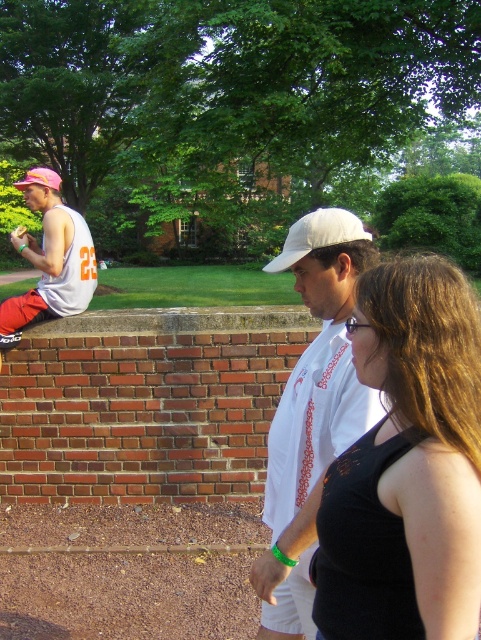
Is white cotton shirt at center to the left of matte white tank top at left from the viewer's perspective?

No, white cotton shirt at center is not to the left of matte white tank top at left.

Does white cotton shirt at center have a lesser width compared to matte white tank top at left?

Indeed, white cotton shirt at center has a lesser width compared to matte white tank top at left.

Who is more distant from viewer, [374,257] or [57,177]?

The point [57,177] is more distant.

In order to click on white cotton shirt at center in this screenshot , I will do `click(312, 413)`.

Between black fabric tank top at center and pink fabric baseball hat at left, which one is positioned higher?

pink fabric baseball hat at left is higher up.

Is point (468, 492) positioned before point (57, 188)?

Yes.

Locate an element on the screen. The width and height of the screenshot is (481, 640). black fabric tank top at center is located at coordinates (407, 465).

The width and height of the screenshot is (481, 640). Identify the location of black fabric tank top at center. (407, 465).

The height and width of the screenshot is (640, 481). I want to click on white cotton shirt at center, so click(x=312, y=413).

Which is more to the right, white cotton shirt at center or white fabric baseball cap at center?

white fabric baseball cap at center is more to the right.

Image resolution: width=481 pixels, height=640 pixels. What do you see at coordinates (312, 413) in the screenshot?
I see `white cotton shirt at center` at bounding box center [312, 413].

I want to click on white cotton shirt at center, so click(312, 413).